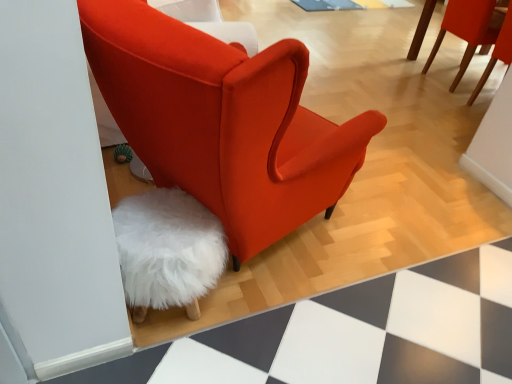
Question: From the image's perspective, is matte red chair at upper right, the first chair in the top-to-bottom sequence, positioned above or below velvet orange chair at center, which is the 2th chair from back to front?

Choices:
 (A) below
 (B) above

Answer: (B)

Question: Based on their positions, is matte red chair at upper right, the 1th chair in the back-to-front sequence, located to the left or right of velvet orange chair at center, placed as the first chair when sorted from bottom to top?

Choices:
 (A) right
 (B) left

Answer: (A)

Question: Estimate the real-world distances between objects in this image. Which object is closer to the white fluffy stool at lower left?

Choices:
 (A) matte red chair at upper right, arranged as the second chair when viewed from the left
 (B) velvet orange chair at center, which appears as the first chair when viewed from the left

Answer: (B)

Question: Which object is positioned farthest from the velvet orange chair at center, placed as the first chair when sorted from bottom to top?

Choices:
 (A) white fluffy stool at lower left
 (B) matte red chair at upper right, which is counted as the second chair, starting from the bottom

Answer: (B)